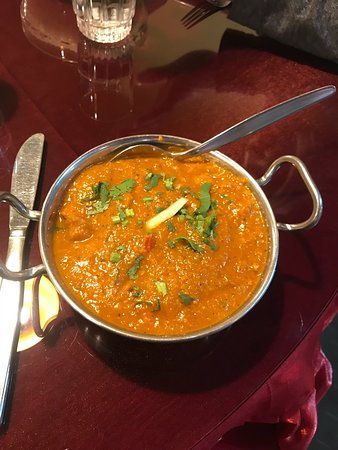
Find the location of `spoon`. spoon is located at coordinates (13, 273), (308, 222), (149, 150).